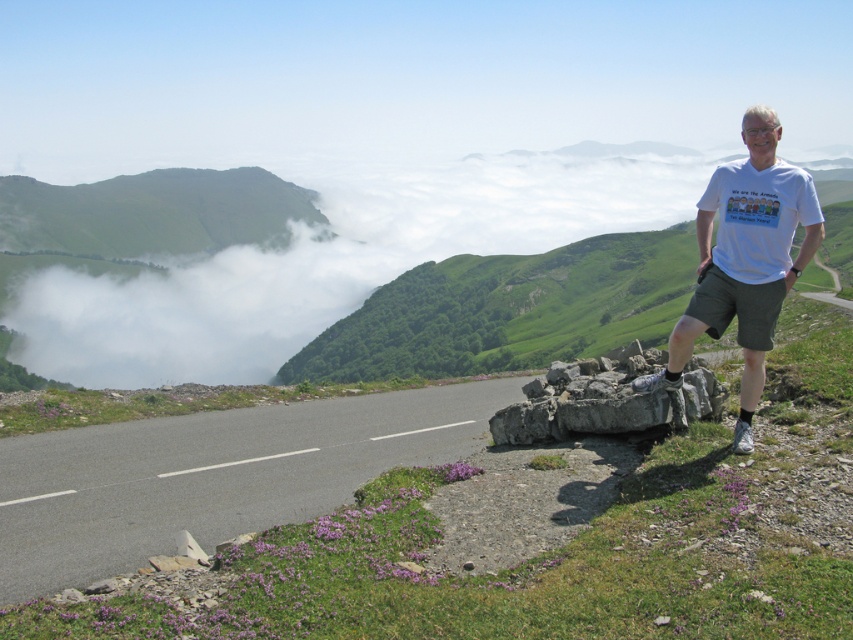
You are standing at the point with coordinates point (x=804, y=172) and want to walk to the point with coordinates point (x=91, y=518). According to the scene, will you be moving towards the road or away from it?

Point (x=91, y=518) is behind point (x=804, y=172), so moving from point (x=804, y=172) to point (x=91, y=518) would mean moving away from the road.